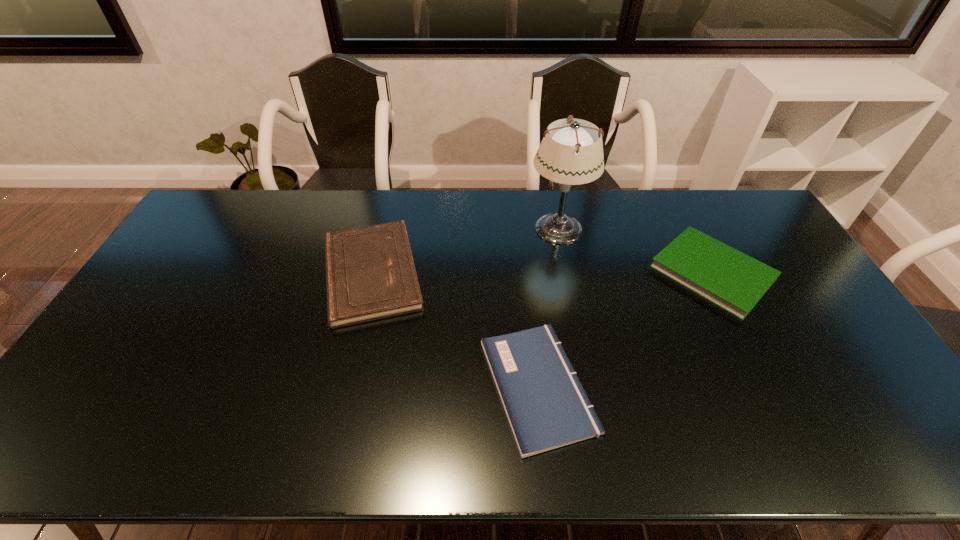
Identify the location of the tallest object. The width and height of the screenshot is (960, 540). (570, 154).

Find the location of a particular element. The image size is (960, 540). the leftmost paperback book is located at coordinates (370, 274).

In order to click on the rightmost object in this screenshot , I will do `click(730, 279)`.

In order to click on the shortest paperback book in this screenshot , I will do `click(546, 406)`.

At what (x,y) coordinates should I click in order to perform the action: click on the shortest object. Please return your answer as a coordinate pair (x, y). Looking at the image, I should click on [546, 406].

Locate an element on the screen. This screenshot has height=540, width=960. blank area located 0.360m on the lampshade of the lampshade is located at coordinates (425, 228).

In order to click on vacant space located 0.170m on the lampshade of the lampshade in this screenshot , I will do click(x=479, y=228).

Locate an element on the screen. free location located 0.230m on the lampshade of the lampshade is located at coordinates click(462, 228).

The height and width of the screenshot is (540, 960). Identify the location of vacant space positioned 0.360m on the front of the leftmost paperback book. (328, 457).

This screenshot has height=540, width=960. I want to click on free space located on the left of the rightmost object, so click(x=561, y=273).